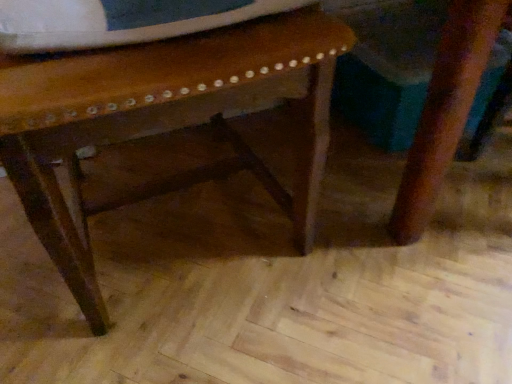
Question: Should I look upward or downward to see wooden stool at center?

Choices:
 (A) up
 (B) down

Answer: (A)